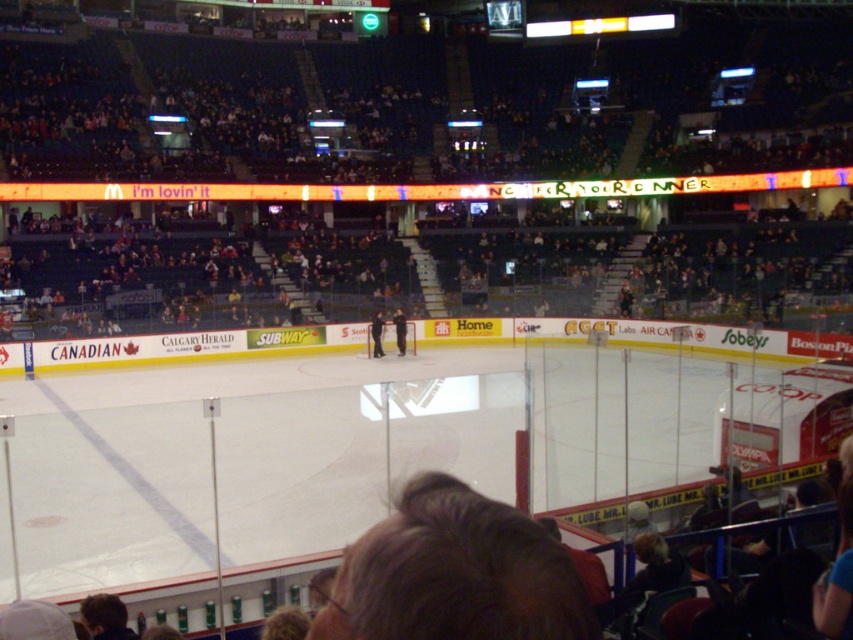
You are a spectator at the game and want to take a photo of the dark blue uniform at center without the black smooth hockey stick at center blocking it. How should you adjust your camera angle?

Move your camera position to the side so that the dark blue uniform at center is no longer behind the black smooth hockey stick at center.